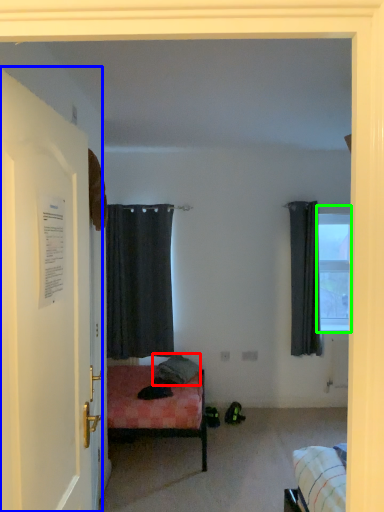
Question: Based on their relative distances, which object is farther from pillow (highlighted by a red box)? Choose from door (highlighted by a blue box) and window (highlighted by a green box).

Choices:
 (A) door
 (B) window

Answer: (A)